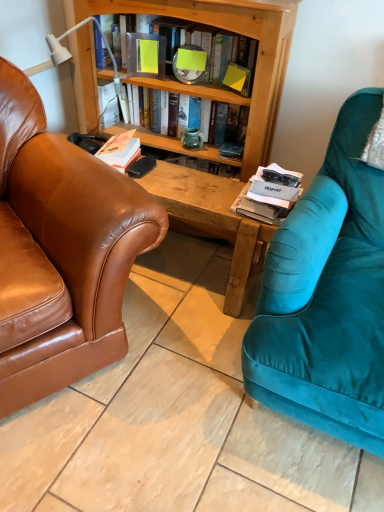
Question: Would you consider teal glass vase at center to be distant from white matte book at center, the third book when ordered from top to bottom?

Choices:
 (A) no
 (B) yes

Answer: (A)

Question: Is teal glass vase at center positioned with its back to white matte book at center, acting as the first book starting from the bottom?

Choices:
 (A) yes
 (B) no

Answer: (B)

Question: Does teal glass vase at center have a larger size compared to white matte book at center, the third book when ordered from top to bottom?

Choices:
 (A) yes
 (B) no

Answer: (B)

Question: Considering the relative sizes of teal glass vase at center and white matte book at center, the third book when ordered from top to bottom, in the image provided, is teal glass vase at center shorter than white matte book at center, the third book when ordered from top to bottom,?

Choices:
 (A) no
 (B) yes

Answer: (A)

Question: From the image's perspective, is teal glass vase at center below white matte book at center, the third book when ordered from top to bottom?

Choices:
 (A) yes
 (B) no

Answer: (B)

Question: Is point (231, 97) positioned closer to the camera than point (124, 153)?

Choices:
 (A) farther
 (B) closer

Answer: (B)

Question: Is hardcover book at center, which is counted as the second book, starting from the bottom, taller or shorter than white matte book at center, the third book when ordered from top to bottom?

Choices:
 (A) tall
 (B) short

Answer: (A)

Question: Is hardcover book at center, acting as the 2th book starting from the top, inside the boundaries of white matte book at center, acting as the first book starting from the bottom, or outside?

Choices:
 (A) inside
 (B) outside

Answer: (B)

Question: Considering the positions of hardcover book at center, acting as the 2th book starting from the top, and white matte book at center, acting as the first book starting from the bottom, in the image, is hardcover book at center, acting as the 2th book starting from the top, wider or thinner than white matte book at center, acting as the first book starting from the bottom,?

Choices:
 (A) thin
 (B) wide

Answer: (A)

Question: Is matte plastic book at upper center, the first book when ordered from top to bottom, situated inside teal glass vase at center or outside?

Choices:
 (A) inside
 (B) outside

Answer: (B)

Question: Looking at the image, does matte plastic book at upper center, the third book in the bottom-to-top sequence, seem bigger or smaller compared to teal glass vase at center?

Choices:
 (A) big
 (B) small

Answer: (A)

Question: Is point (162, 24) closer or farther from the camera than point (198, 131)?

Choices:
 (A) closer
 (B) farther

Answer: (A)

Question: Considering the positions of matte plastic book at upper center, the third book in the bottom-to-top sequence, and teal glass vase at center in the image, is matte plastic book at upper center, the third book in the bottom-to-top sequence, wider or thinner than teal glass vase at center?

Choices:
 (A) wide
 (B) thin

Answer: (A)

Question: From the image's perspective, is white matte book at center, acting as the first book starting from the bottom, located above or below teal glass vase at center?

Choices:
 (A) above
 (B) below

Answer: (B)

Question: Is white matte book at center, the third book when ordered from top to bottom, bigger or smaller than teal glass vase at center?

Choices:
 (A) big
 (B) small

Answer: (A)